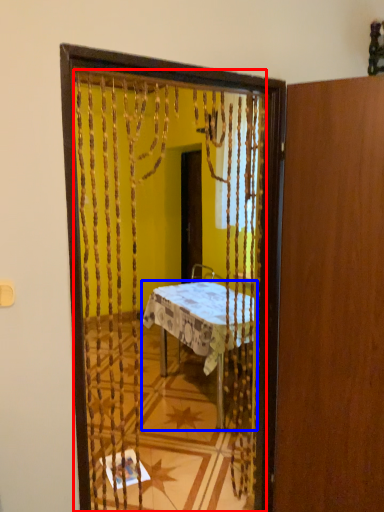
Question: Among these objects, which one is farthest to the camera, mirror (highlighted by a red box) or desk (highlighted by a blue box)?

Choices:
 (A) mirror
 (B) desk

Answer: (B)